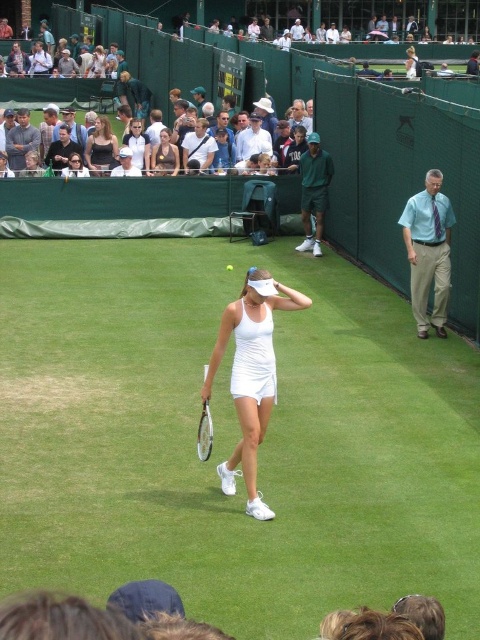
You are a drone operator tasked with capturing aerial footage of the tennis match. The camera is currently positioned above the center of the court. To ensure the white fabric tennis court at center is centered in the frame, where should you adjust the camera? Specify coordinates as a point in the format like point X,Y.

The white fabric tennis court at center is located at point (230, 438), so you should adjust the camera to that point to center it.

You are a tennis ball judge observing the court. You notice the white matte tennis outfit at center and the yellow rubber tennis ball at center. Which object is closer to the spectators behind the green fence?

The yellow rubber tennis ball at center is closer to the spectators behind the green fence because the white matte tennis outfit at center is in front of it.